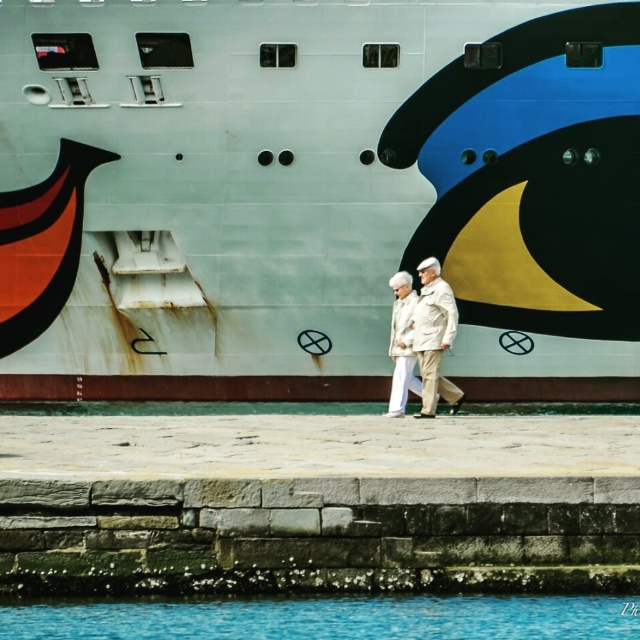
Question: Considering the real-world distances, which object is closest to the beige fabric coat at center?

Choices:
 (A) blue liquid water at lower center
 (B) white matte ship at center

Answer: (B)

Question: Among these objects, which one is nearest to the camera?

Choices:
 (A) blue liquid water at lower center
 (B) white matte ship at center
 (C) beige fabric coat at center

Answer: (A)

Question: Which point is farther to the camera?

Choices:
 (A) beige fabric coat at center
 (B) white matte ship at center

Answer: (B)

Question: Is white matte ship at center to the left of blue liquid water at lower center from the viewer's perspective?

Choices:
 (A) no
 (B) yes

Answer: (B)

Question: Can you confirm if blue liquid water at lower center is bigger than beige fabric coat at center?

Choices:
 (A) yes
 (B) no

Answer: (B)

Question: Does blue liquid water at lower center appear on the right side of beige fabric coat at center?

Choices:
 (A) yes
 (B) no

Answer: (B)